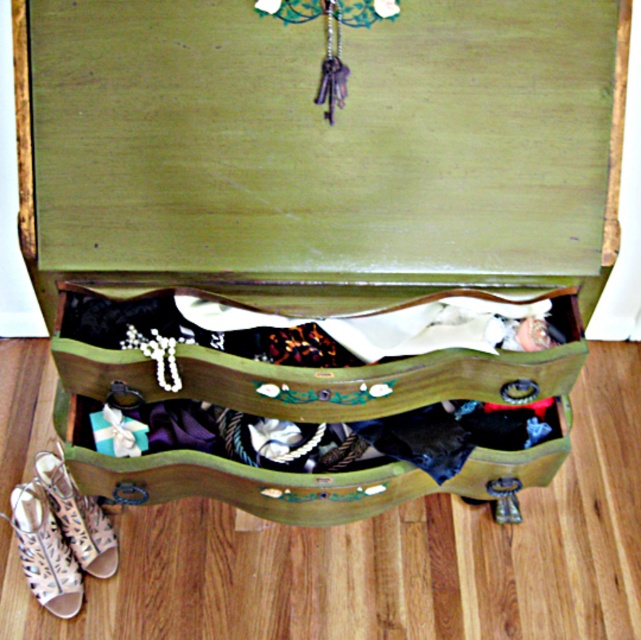
Measure the distance between point (301,403) and camera.

Point (301,403) and camera are 37.40 inches apart.

In the scene shown: Is green painted wood drawer at center wider than white lace-up sandal at lower left?

Yes, green painted wood drawer at center is wider than white lace-up sandal at lower left.

Does point (562, 381) come closer to viewer compared to point (53, 552)?

Yes.

Find the location of a particular element. The image size is (641, 640). green painted wood drawer at center is located at coordinates (310, 416).

Does white lace-up sandal at lower left appear on the right side of leather/textured sandal at lower left?

In fact, white lace-up sandal at lower left is to the left of leather/textured sandal at lower left.

Between point (12, 500) and point (46, 486), which one is positioned behind?

Point (46, 486)

Identify the location of white lace-up sandal at lower left. (44, 552).

Does point (413, 448) lie behind point (62, 481)?

No, (413, 448) is closer to viewer.

Locate an element on the screen. Image resolution: width=641 pixels, height=640 pixels. green painted wood drawer at center is located at coordinates (310, 416).

Is point (297, 468) less distant than point (53, 465)?

Yes, point (297, 468) is closer to viewer.

Image resolution: width=641 pixels, height=640 pixels. In order to click on green painted wood drawer at center in this screenshot , I will do `click(310, 416)`.